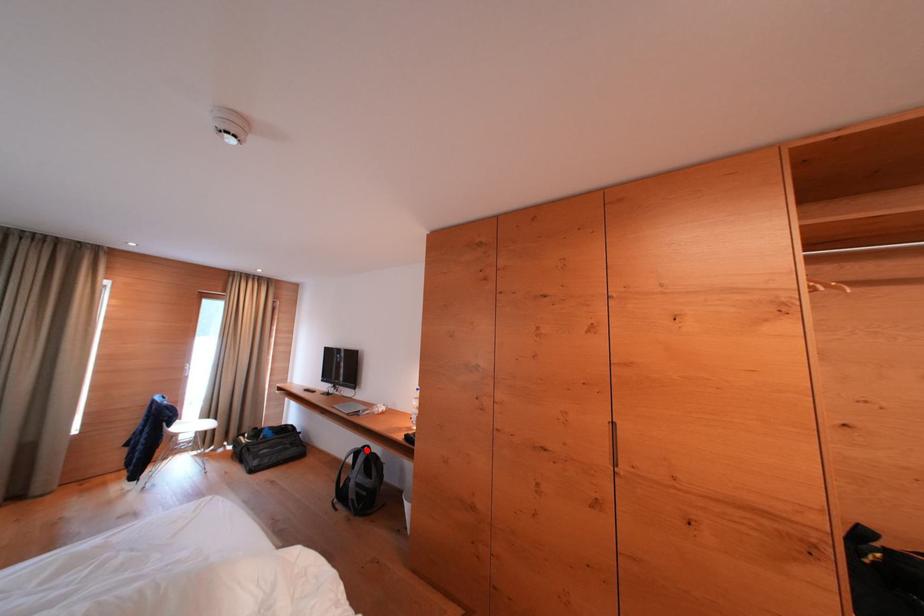
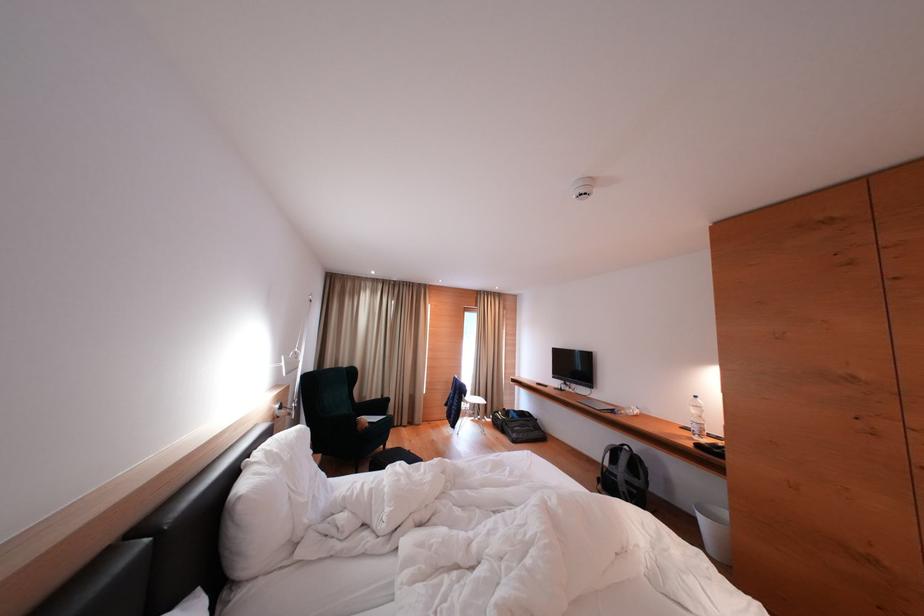
Find the pixel in the second image that matches the highlighted location in the first image.

(624, 448)